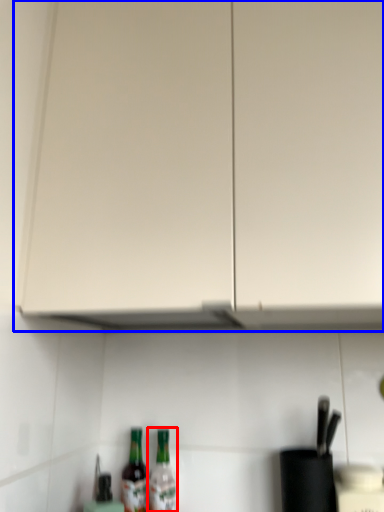
Question: Which object appears closest to the camera in this image, bottle (highlighted by a red box) or cabinetry (highlighted by a blue box)?

Choices:
 (A) bottle
 (B) cabinetry

Answer: (B)